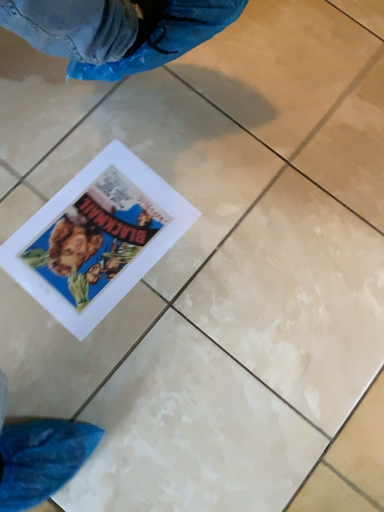
The image size is (384, 512). Find the location of `vacant area to the right of blue matte poster at center`. vacant area to the right of blue matte poster at center is located at coordinates (221, 267).